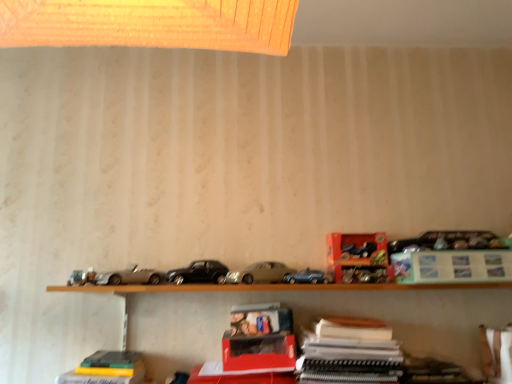
Question: Which is correct: matte silver car at center, which is the second car from left to right, is inside wooden shelf at lower center, or outside of it?

Choices:
 (A) outside
 (B) inside

Answer: (A)

Question: Considering the positions of matte silver car at center, acting as the first car starting from the right, and wooden shelf at lower center in the image, is matte silver car at center, acting as the first car starting from the right, wider or thinner than wooden shelf at lower center?

Choices:
 (A) wide
 (B) thin

Answer: (A)

Question: Estimate the real-world distances between objects in this image. Which object is closer to the green matte paper at upper right, the second paperback book when ordered from bottom to top?

Choices:
 (A) hardcover book at lower left
 (B) metallic silver toolbox at center-right, acting as the 1th toy starting from the bottom
 (C) matte silver car at center, which is the second car from left to right
 (D) metallic blue car at center, the first model car when ordered from right to left
 (E) metallic silver car at left, positioned as the second model car in right-to-left order

Answer: (B)

Question: Based on their relative distances, which object is farther from the hardcover book at lower left?

Choices:
 (A) metallic blue car at upper right, which is counted as the 1th toy, starting from the top
 (B) matte silver car at center, which is the second car from left to right
 (C) green matte paper at upper right, which is the 1th paperback book in top-to-bottom order
 (D) black metallic car at center, the second car positioned from the right
 (E) metallic blue car at center, the first model car when ordered from right to left

Answer: (C)